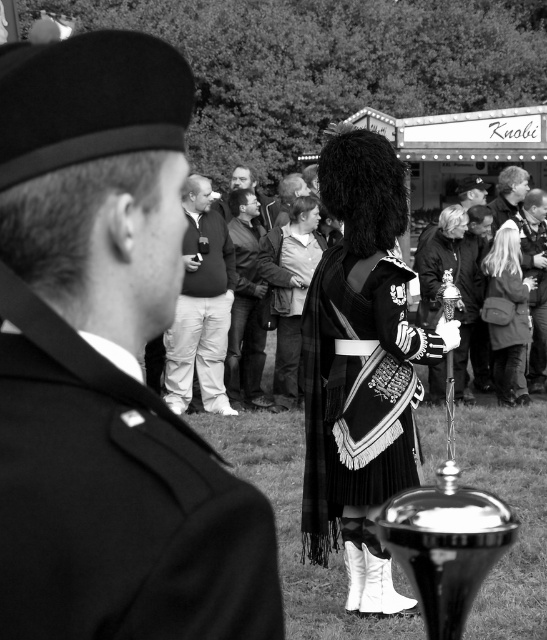
You are standing at the camera position and want to take a closer photo of the silky black dress at center. If your camera can focus on objects up to 30 feet away, will you be able to capture the dress clearly?

The silky black dress at center is 38.14 feet away from the camera, which exceeds the camera focus limit of 30 feet. Therefore, you won cannot capture the dress clearly.

You are standing at the origin point of the image coordinate system. The uniformed man at center is located at point (x=107, y=364). Can you determine the direction you need to move to reach the uniformed man at center?

To reach the uniformed man at center located at point (x=107, y=364) from the origin, you would need to move 0.570 units to the right and 0.197 units downward in the image coordinate system.